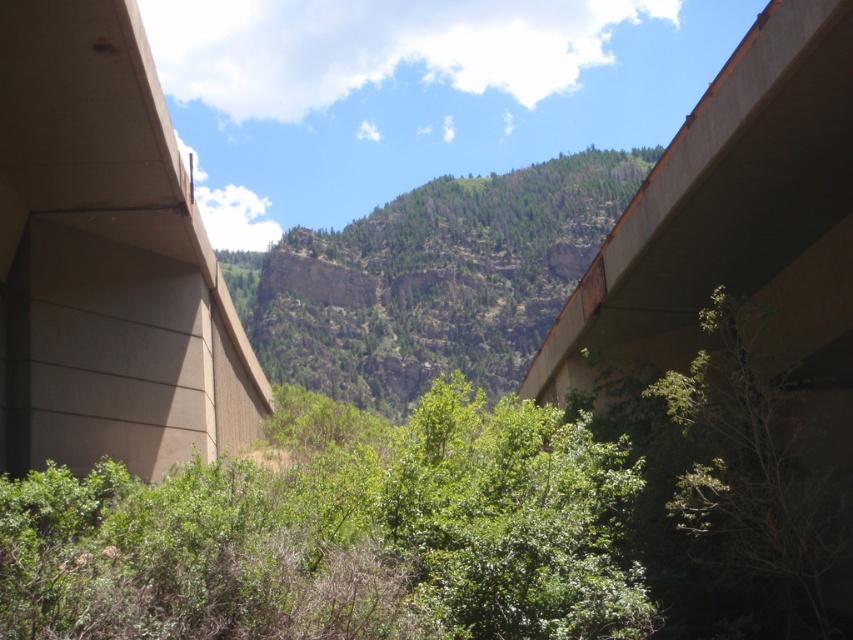
Between point (151, 225) and point (724, 417), which one is positioned behind?

The point (151, 225) is more distant.

Identify the location of concrete overpass at left. (106, 259).

Who is more forward, (115, 40) or (728, 502)?

Point (115, 40) is in front.

Find the location of `concrete overpass at left`. concrete overpass at left is located at coordinates (106, 259).

Based on the photo, can you confirm if concrete bridge at upper right is positioned above green leafy tree at lower right?

Correct, concrete bridge at upper right is located above green leafy tree at lower right.

Who is positioned more to the left, concrete bridge at upper right or green leafy tree at lower right?

concrete bridge at upper right is more to the left.

Where is `concrete bridge at upper right`? concrete bridge at upper right is located at coordinates (722, 192).

You are a GUI agent. You are given a task and a screenshot of the screen. Output one action in this format:
    pyautogui.click(x=<x>, y=<y>)
    Task: Click on the concrete bridge at upper right
    The width and height of the screenshot is (853, 640).
    Given the screenshot: What is the action you would take?
    pyautogui.click(x=722, y=192)

Can you confirm if green rocky mountain at center is taller than green leafy tree at lower right?

Yes, green rocky mountain at center is taller than green leafy tree at lower right.

Between point (465, 324) and point (790, 516), which one is positioned in front?

Point (790, 516)

You are a GUI agent. You are given a task and a screenshot of the screen. Output one action in this format:
    pyautogui.click(x=<x>, y=<y>)
    Task: Click on the green rocky mountain at center
    The height and width of the screenshot is (640, 853).
    Given the screenshot: What is the action you would take?
    pyautogui.click(x=431, y=280)